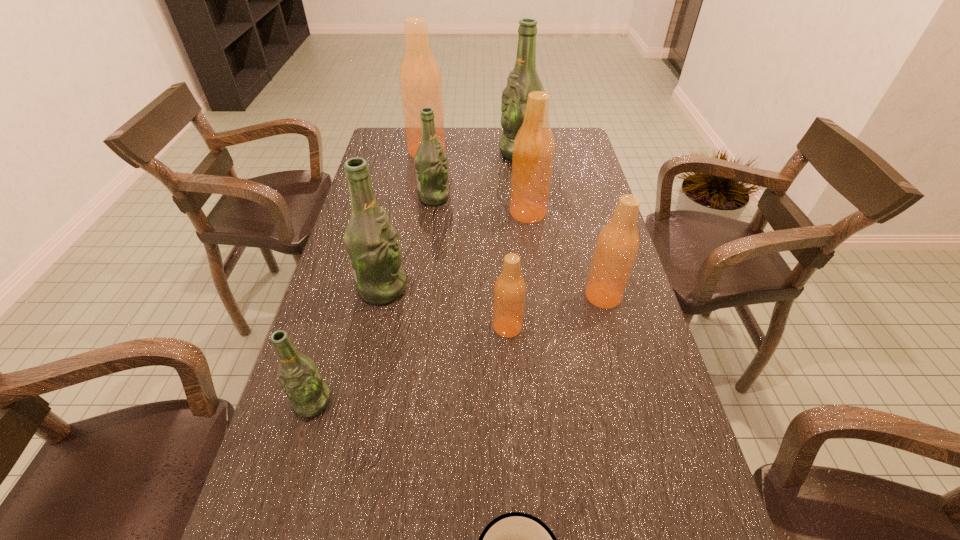
Identify the location of free space that is in between the second smallest tan beer bottle and the second nearest beer bottle. Image resolution: width=960 pixels, height=540 pixels. (555, 312).

Image resolution: width=960 pixels, height=540 pixels. Find the location of `free space between the third biggest tan beer bottle and the biggest green beer bottle`. free space between the third biggest tan beer bottle and the biggest green beer bottle is located at coordinates (562, 225).

Where is `unoccupied area between the nearest tan beer bottle and the second nearest green beer bottle`? This screenshot has width=960, height=540. unoccupied area between the nearest tan beer bottle and the second nearest green beer bottle is located at coordinates (444, 307).

Where is `free space between the eighth farthest object and the rightmost beer bottle`? free space between the eighth farthest object and the rightmost beer bottle is located at coordinates (458, 349).

Locate which object is the seventh closest to the biggest tan beer bottle. Please provide its 2D coordinates. Your answer should be formatted as a tuple, i.e. [(x, y)], where the tuple contains the x and y coordinates of a point satisfying the conditions above.

[(309, 395)]

This screenshot has height=540, width=960. What are the coordinates of `object that can be found as the third closest to the nearest object` in the screenshot? It's located at (617, 245).

Identify the location of the third closest beer bottle to the second farthest tan beer bottle. click(617, 245).

Locate an element on the screen. beer bottle that is the closest to the second nearest object is located at coordinates (371, 242).

Identify which green beer bottle is located as the third nearest to the second nearest green beer bottle. Please provide its 2D coordinates. Your answer should be formatted as a tuple, i.e. [(x, y)], where the tuple contains the x and y coordinates of a point satisfying the conditions above.

[(523, 79)]

Locate which green beer bottle is the third closest to the nearest object. Please provide its 2D coordinates. Your answer should be formatted as a tuple, i.e. [(x, y)], where the tuple contains the x and y coordinates of a point satisfying the conditions above.

[(430, 161)]